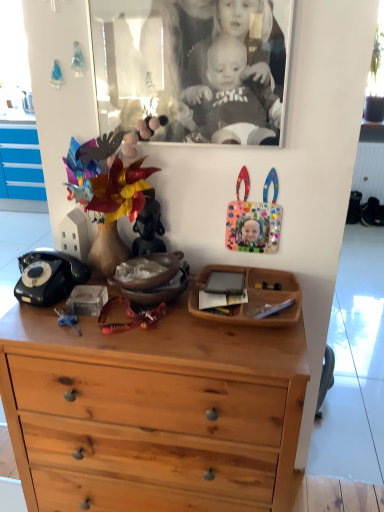
At what (x,y) coordinates should I click in order to perform the action: click on colorful plastic frame at upper right, positioned as the 2th toy in left-to-right order. Please return your answer as a coordinate pair (x, y). The image size is (384, 512). Looking at the image, I should click on (254, 219).

Where is `colorful plastic frame at upper right, the 1th toy in the right-to-left sequence`? Image resolution: width=384 pixels, height=512 pixels. colorful plastic frame at upper right, the 1th toy in the right-to-left sequence is located at coordinates (254, 219).

Considering the relative sizes of light brown wood chest of drawers at center and matte ceramic vase at center, which is the 2th toy from right to left, in the image provided, is light brown wood chest of drawers at center wider than matte ceramic vase at center, which is the 2th toy from right to left,?

Yes.

Is light brown wood chest of drawers at center positioned behind matte ceramic vase at center, placed as the first toy when sorted from left to right?

That is False.

Is light brown wood chest of drawers at center inside the boundaries of matte ceramic vase at center, which is the 2th toy from right to left, or outside?

The correct answer is: outside.

Considering the positions of objects colorful plastic frame at upper right, the 1th toy in the right-to-left sequence, and light brown wood chest of drawers at center in the image provided, who is behind, colorful plastic frame at upper right, the 1th toy in the right-to-left sequence, or light brown wood chest of drawers at center?

colorful plastic frame at upper right, the 1th toy in the right-to-left sequence, is more distant.

Is colorful plastic frame at upper right, positioned as the 2th toy in left-to-right order, spatially inside light brown wood chest of drawers at center, or outside of it?

colorful plastic frame at upper right, positioned as the 2th toy in left-to-right order, is not inside light brown wood chest of drawers at center, it's outside.

Which is in front, point (267, 208) or point (234, 336)?

The point (234, 336) is in front.

Is colorful plastic frame at upper right, positioned as the 2th toy in left-to-right order, wider than light brown wood chest of drawers at center?

In fact, colorful plastic frame at upper right, positioned as the 2th toy in left-to-right order, might be narrower than light brown wood chest of drawers at center.

Is colorful plastic frame at upper right, the 1th toy in the right-to-left sequence, taller or shorter than black glass picture frame at upper center?

colorful plastic frame at upper right, the 1th toy in the right-to-left sequence, is shorter than black glass picture frame at upper center.

Find the location of a particular element. This screenshot has width=384, height=512. picture frame in front of the colorful plastic frame at upper right, the 1th toy in the right-to-left sequence is located at coordinates (193, 61).

Based on the photo, considering the sizes of objects colorful plastic frame at upper right, positioned as the 2th toy in left-to-right order, and black glass picture frame at upper center in the image provided, who is wider, colorful plastic frame at upper right, positioned as the 2th toy in left-to-right order, or black glass picture frame at upper center?

Wider between the two is black glass picture frame at upper center.

Which is behind, colorful plastic frame at upper right, positioned as the 2th toy in left-to-right order, or black glass picture frame at upper center?

colorful plastic frame at upper right, positioned as the 2th toy in left-to-right order, is further away from the camera.

From the image's perspective, between black glass picture frame at upper center and colorful plastic frame at upper right, the 1th toy in the right-to-left sequence, who is located below?

colorful plastic frame at upper right, the 1th toy in the right-to-left sequence.

From the picture: Is the surface of black glass picture frame at upper center in direct contact with colorful plastic frame at upper right, the 1th toy in the right-to-left sequence?

No.

Based on the photo, is black glass picture frame at upper center to the left or to the right of colorful plastic frame at upper right, the 1th toy in the right-to-left sequence, in the image?

In the image, black glass picture frame at upper center appears on the left side of colorful plastic frame at upper right, the 1th toy in the right-to-left sequence.

From a real-world perspective, relative to colorful plastic frame at upper right, positioned as the 2th toy in left-to-right order, is black glass picture frame at upper center vertically above or below?

In terms of real-world spatial position, black glass picture frame at upper center is above colorful plastic frame at upper right, positioned as the 2th toy in left-to-right order.

Is matte ceramic vase at center, which is the 2th toy from right to left, positioned far away from black glass picture frame at upper center?

No, there isn't a large distance between matte ceramic vase at center, which is the 2th toy from right to left, and black glass picture frame at upper center.

Which point is more forward, (148, 227) or (248, 110)?

The point (248, 110) is closer to the camera.

What's the angular difference between matte ceramic vase at center, placed as the first toy when sorted from left to right, and black glass picture frame at upper center's facing directions?

There is a 0.827-degree angle between the facing directions of matte ceramic vase at center, placed as the first toy when sorted from left to right, and black glass picture frame at upper center.

In the scene shown: Could you tell me if matte ceramic vase at center, placed as the first toy when sorted from left to right, is turned towards black glass picture frame at upper center?

No, matte ceramic vase at center, placed as the first toy when sorted from left to right, is not turned towards black glass picture frame at upper center.

From a real-world perspective, is black glass picture frame at upper center positioned over matte ceramic vase at center, placed as the first toy when sorted from left to right, based on gravity?

Yes, from a real-world perspective, black glass picture frame at upper center is above matte ceramic vase at center, placed as the first toy when sorted from left to right.

Considering the relative sizes of black glass picture frame at upper center and matte ceramic vase at center, which is the 2th toy from right to left, in the image provided, is black glass picture frame at upper center shorter than matte ceramic vase at center, which is the 2th toy from right to left,?

Incorrect, the height of black glass picture frame at upper center does not fall short of that of matte ceramic vase at center, which is the 2th toy from right to left.

Is the depth of black glass picture frame at upper center less than that of matte ceramic vase at center, which is the 2th toy from right to left?

Yes.

In the scene shown: How different are the orientations of black glass picture frame at upper center and matte ceramic vase at center, placed as the first toy when sorted from left to right, in degrees?

The angular difference between black glass picture frame at upper center and matte ceramic vase at center, placed as the first toy when sorted from left to right, is 0.827 degrees.

From the image's perspective, does black glass picture frame at upper center appear lower than light brown wood chest of drawers at center?

No.

From a real-world perspective, which object rests below the other?

light brown wood chest of drawers at center, from a real-world perspective.

Considering the sizes of objects black glass picture frame at upper center and light brown wood chest of drawers at center in the image provided, who is taller, black glass picture frame at upper center or light brown wood chest of drawers at center?

light brown wood chest of drawers at center is taller.

Considering the sizes of black glass picture frame at upper center and light brown wood chest of drawers at center in the image, is black glass picture frame at upper center bigger or smaller than light brown wood chest of drawers at center?

Considering their sizes, black glass picture frame at upper center takes up less space than light brown wood chest of drawers at center.

Which toy is the 2nd one when counting from the back of the light brown wood chest of drawers at center? Please provide its 2D coordinates.

[(148, 227)]

Locate an element on the screen. The height and width of the screenshot is (512, 384). toy that is the 2nd object located above the light brown wood chest of drawers at center (from the image's perspective) is located at coordinates (254, 219).

Based on their spatial positions, is colorful plastic frame at upper right, the 1th toy in the right-to-left sequence, or matte ceramic vase at center, which is the 2th toy from right to left, closer to black glass picture frame at upper center?

colorful plastic frame at upper right, the 1th toy in the right-to-left sequence.

Based on their spatial positions, is colorful plastic frame at upper right, positioned as the 2th toy in left-to-right order, or black glass picture frame at upper center closer to light brown wood chest of drawers at center?

The object closer to light brown wood chest of drawers at center is colorful plastic frame at upper right, positioned as the 2th toy in left-to-right order.

Estimate the real-world distances between objects in this image. Which object is further from colorful plastic frame at upper right, positioned as the 2th toy in left-to-right order, matte ceramic vase at center, placed as the first toy when sorted from left to right, or light brown wood chest of drawers at center?

light brown wood chest of drawers at center is further to colorful plastic frame at upper right, positioned as the 2th toy in left-to-right order.

Based on their spatial positions, is matte ceramic vase at center, which is the 2th toy from right to left, or colorful plastic frame at upper right, positioned as the 2th toy in left-to-right order, further from light brown wood chest of drawers at center?

colorful plastic frame at upper right, positioned as the 2th toy in left-to-right order, lies further to light brown wood chest of drawers at center than the other object.

Which object lies nearer to the anchor point colorful plastic frame at upper right, positioned as the 2th toy in left-to-right order, black glass picture frame at upper center or light brown wood chest of drawers at center?

black glass picture frame at upper center lies closer to colorful plastic frame at upper right, positioned as the 2th toy in left-to-right order, than the other object.

Considering their positions, is light brown wood chest of drawers at center positioned closer to matte ceramic vase at center, placed as the first toy when sorted from left to right, than black glass picture frame at upper center?

black glass picture frame at upper center is closer to matte ceramic vase at center, placed as the first toy when sorted from left to right.

Estimate the real-world distances between objects in this image. Which object is closer to black glass picture frame at upper center, colorful plastic frame at upper right, the 1th toy in the right-to-left sequence, or light brown wood chest of drawers at center?

colorful plastic frame at upper right, the 1th toy in the right-to-left sequence, is positioned closer to the anchor black glass picture frame at upper center.

From the image, which object appears to be nearer to light brown wood chest of drawers at center, black glass picture frame at upper center or matte ceramic vase at center, placed as the first toy when sorted from left to right?

matte ceramic vase at center, placed as the first toy when sorted from left to right, is positioned closer to the anchor light brown wood chest of drawers at center.

Locate an element on the screen. The image size is (384, 512). toy that lies between black glass picture frame at upper center and matte ceramic vase at center, which is the 2th toy from right to left, from top to bottom is located at coordinates (254, 219).

This screenshot has width=384, height=512. Identify the location of toy between colorful plastic frame at upper right, positioned as the 2th toy in left-to-right order, and light brown wood chest of drawers at center, in the vertical direction. (148, 227).